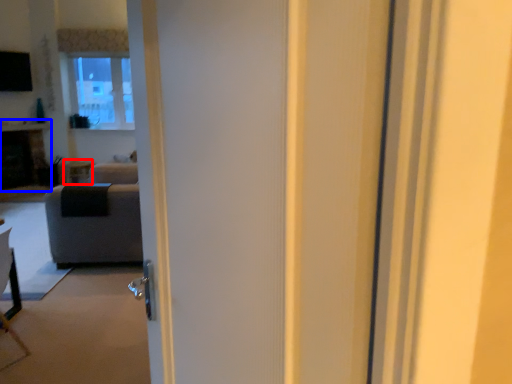
Question: Which of the following is the closest to the observer, side table (highlighted by a red box) or fireplace (highlighted by a blue box)?

Choices:
 (A) side table
 (B) fireplace

Answer: (B)